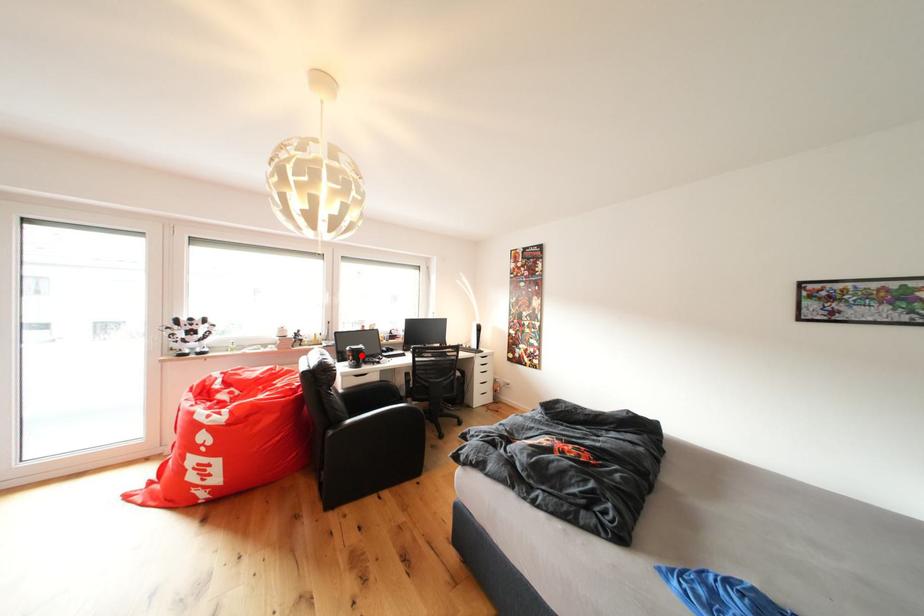
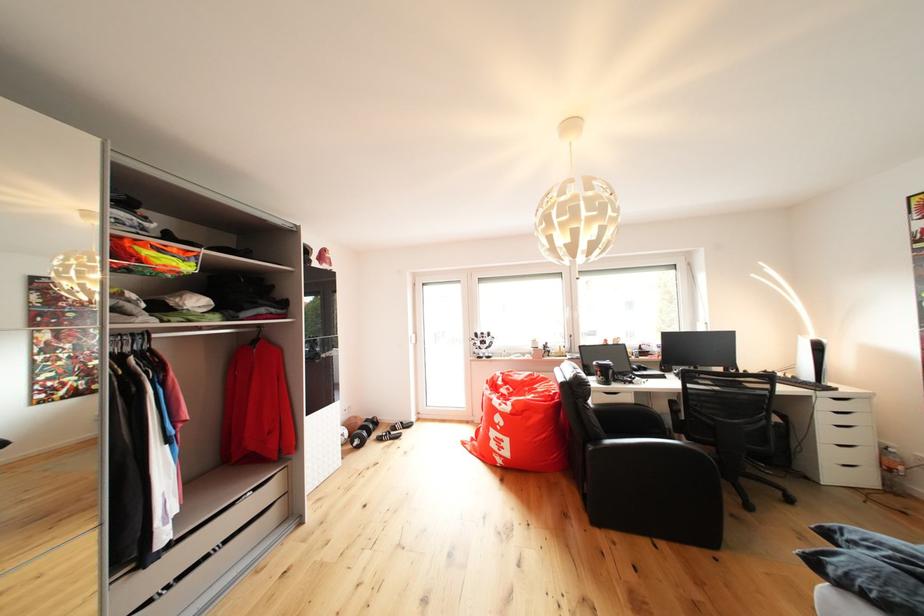
The point at the highlighted location is marked in the first image. Where is the corresponding point in the second image?

(609, 371)